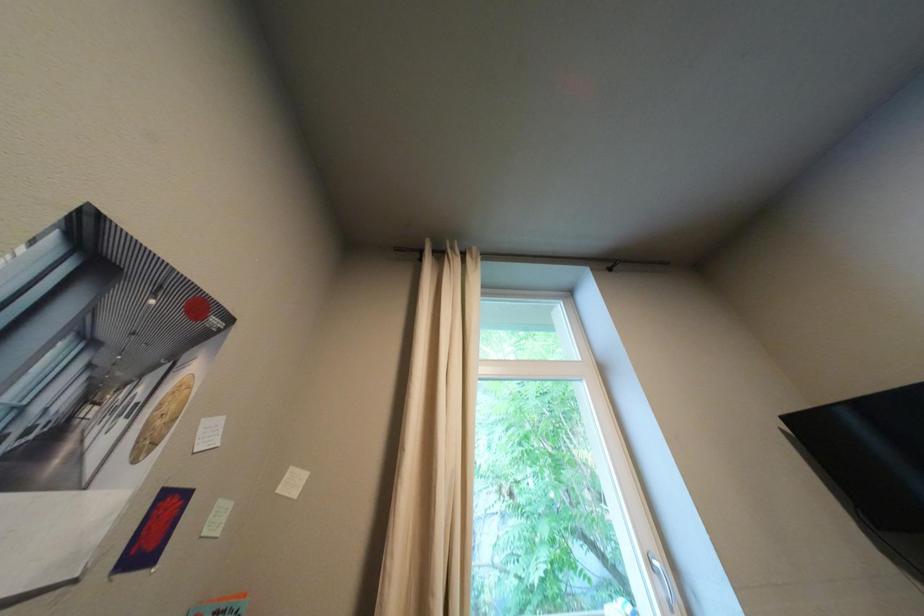
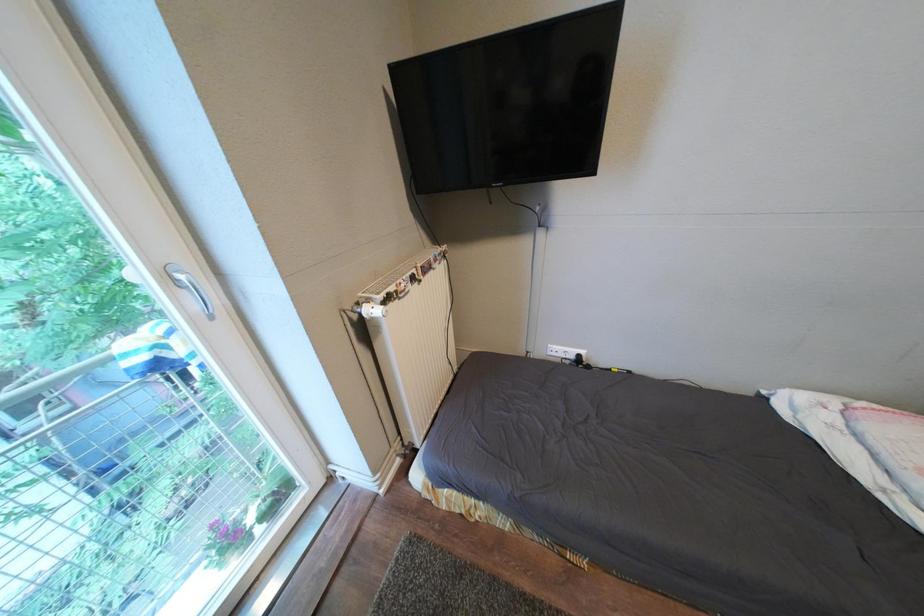
Based on the continuous images, in which direction is the camera rotating?

The rotation direction of the camera is right-down.